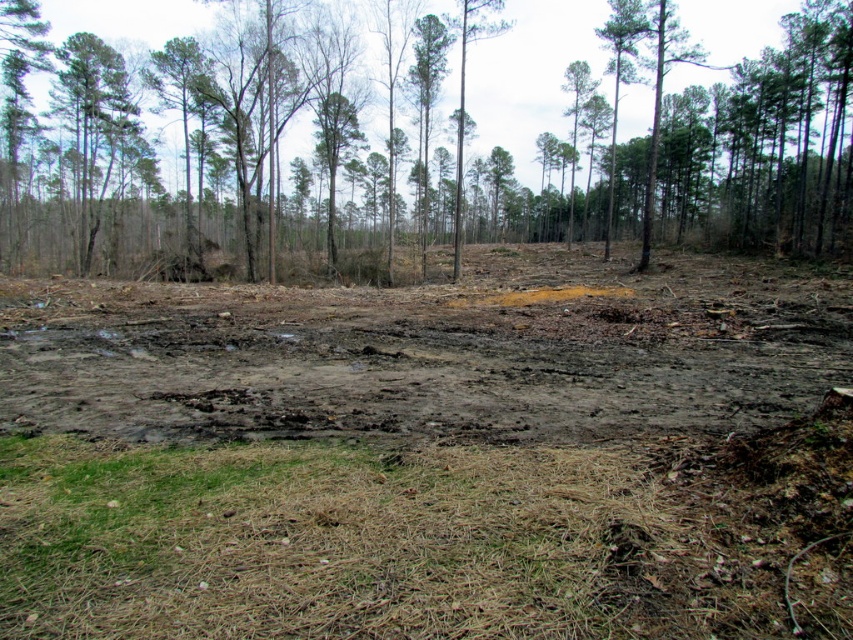
You are navigating a drone over the forest clearing and need to land it precisely on the brown muddy field at center. According to the coordinates provided, where should you direct the drone to land?

The brown muddy field at center is located at point (x=422, y=451), so you should direct the drone to land there.

You are a hiker who wants to set up a tent in the clearing. The brown muddy field at center and the green leafy tree at upper center are in your view. Which location would be better to avoid getting your tent wet during rain?

The green leafy tree at upper center provides shelter from rain, so setting up the tent under it, specifically where the brown muddy field at center is positioned under the tree, would help keep the tent drier compared to open areas.